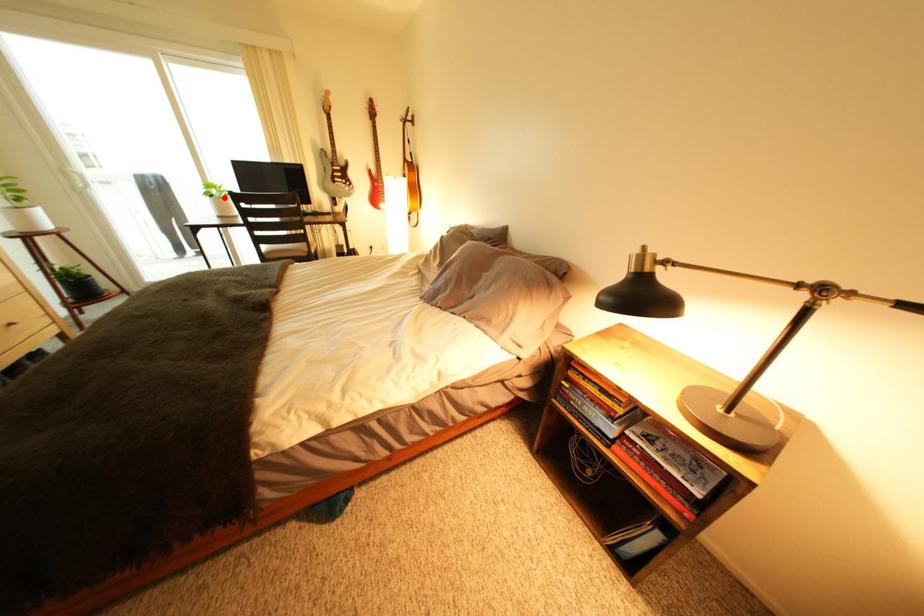
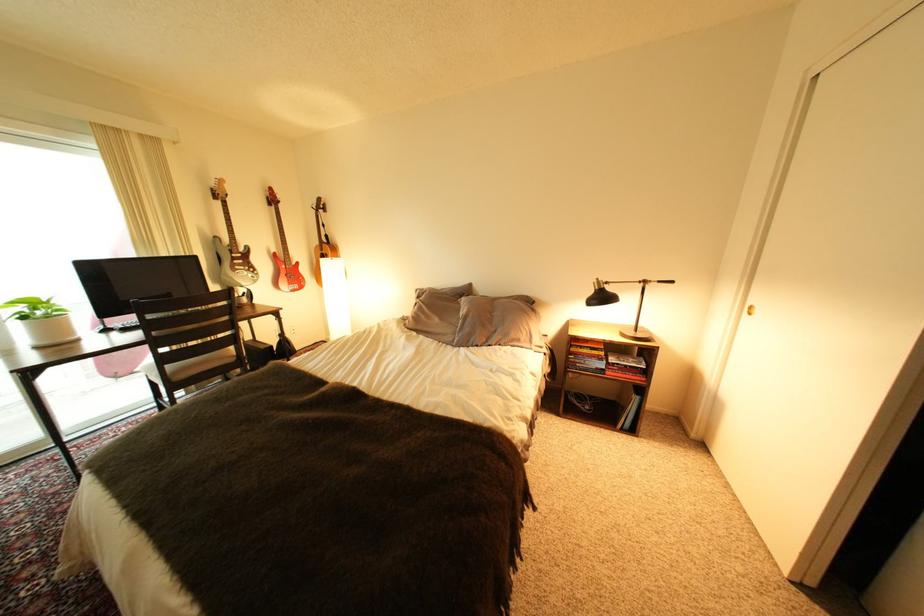
Find the pixel in the second image that matches the highlighted location in the first image.

(37, 318)